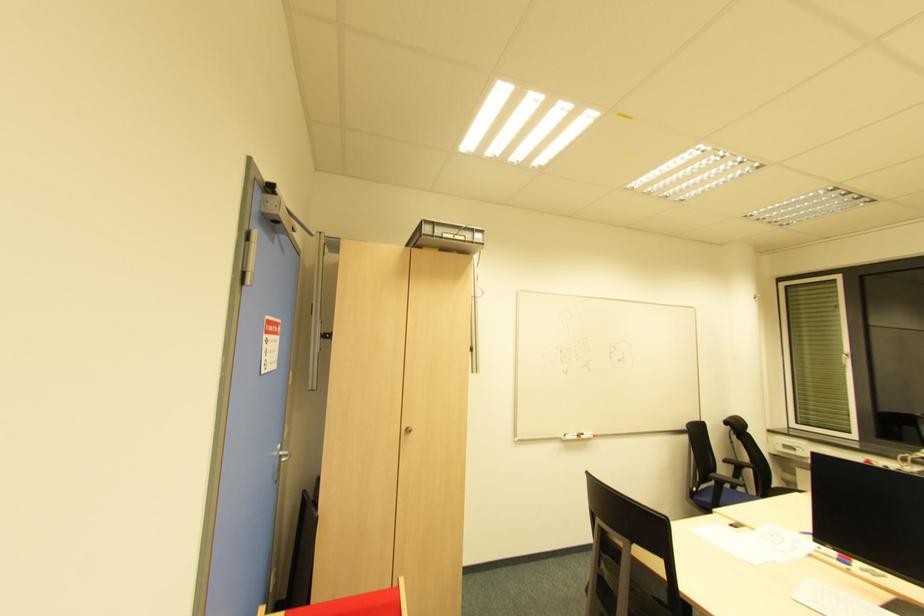
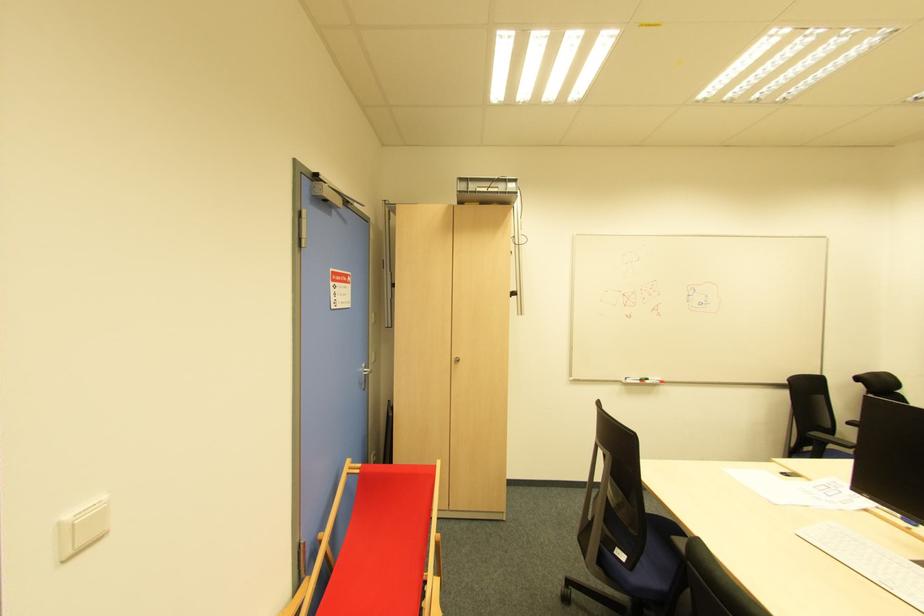
The point at (594, 438) is marked in the first image. Where is the corresponding point in the second image?

(662, 383)